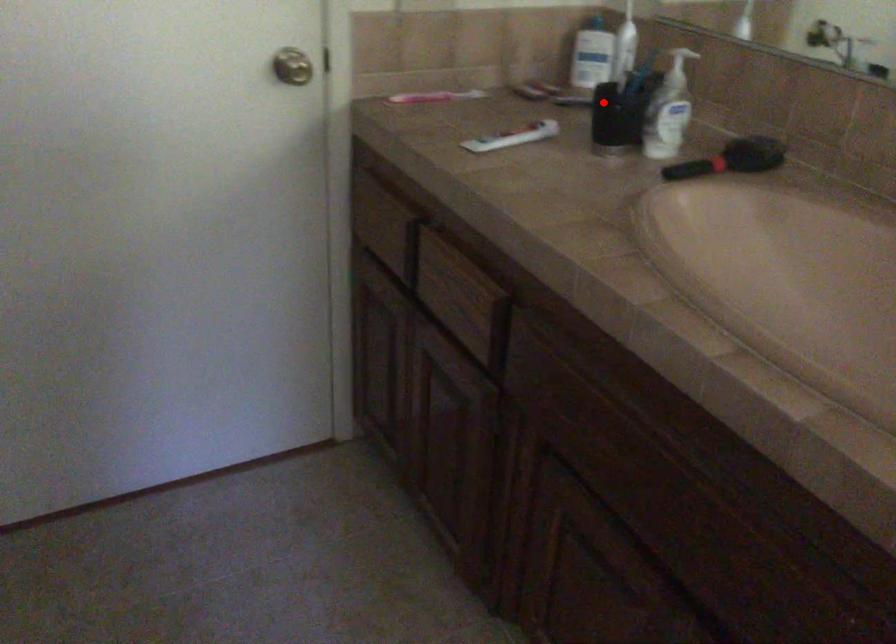
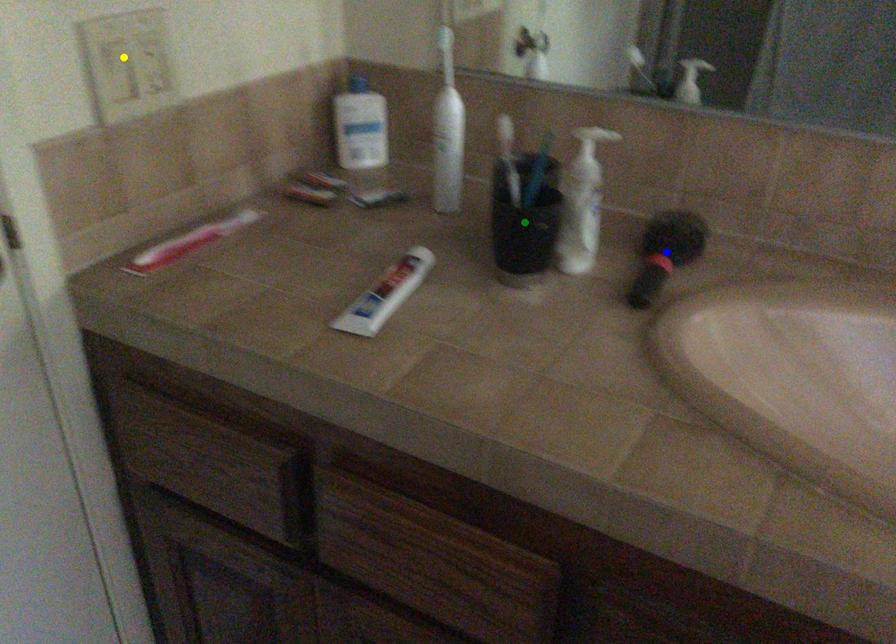
Question: I am providing you with two images of the same scene from different viewpoints. A red point is marked on the first image. You are given multiple points on the second image. Which point in image 2 is actually the same real-world point as the red point in image 1?

Choices:
 (A) yellow point
 (B) blue point
 (C) green point

Answer: (C)